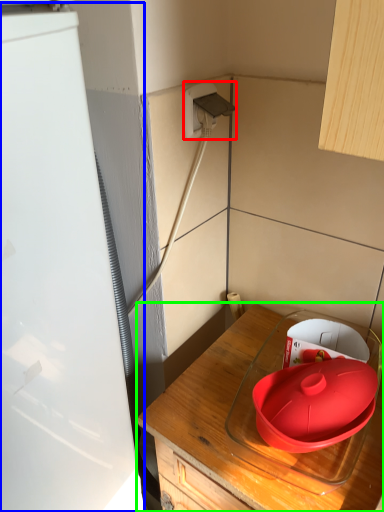
Question: Which object is the closest to the electric outlet (highlighted by a red box)? Choose among these: appliance (highlighted by a blue box) or countertop (highlighted by a green box).

Choices:
 (A) appliance
 (B) countertop

Answer: (A)